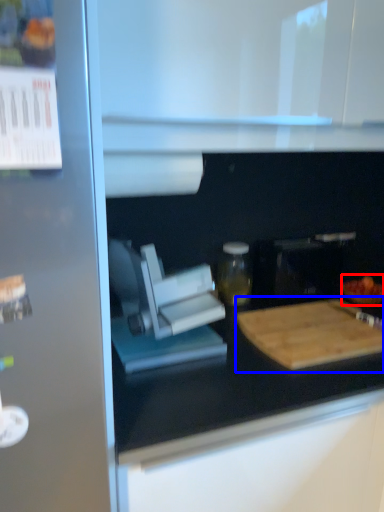
Question: Which of the following is the closest to the observer, food (highlighted by a red box) or cutting board (highlighted by a blue box)?

Choices:
 (A) food
 (B) cutting board

Answer: (B)